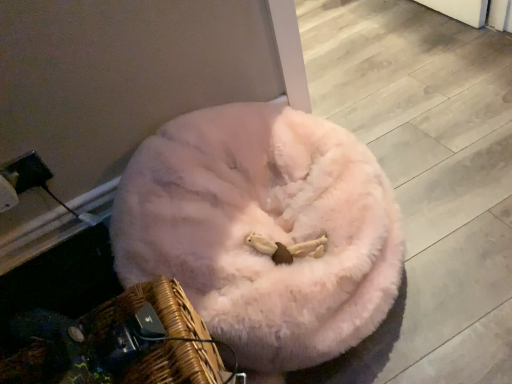
This screenshot has width=512, height=384. Identify the location of fluffy pink dog bed at center. (263, 230).

Image resolution: width=512 pixels, height=384 pixels. Describe the element at coordinates (263, 230) in the screenshot. I see `fluffy pink dog bed at center` at that location.

Find the location of `fluffy pink dog bed at center`. fluffy pink dog bed at center is located at coordinates (263, 230).